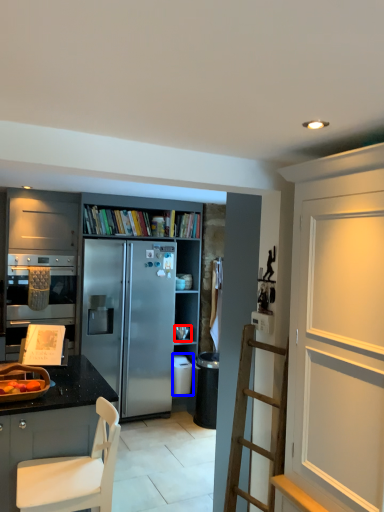
Question: Which of the following is the closest to the observer, appliance (highlighted by a red box) or appliance (highlighted by a blue box)?

Choices:
 (A) appliance
 (B) appliance

Answer: (B)